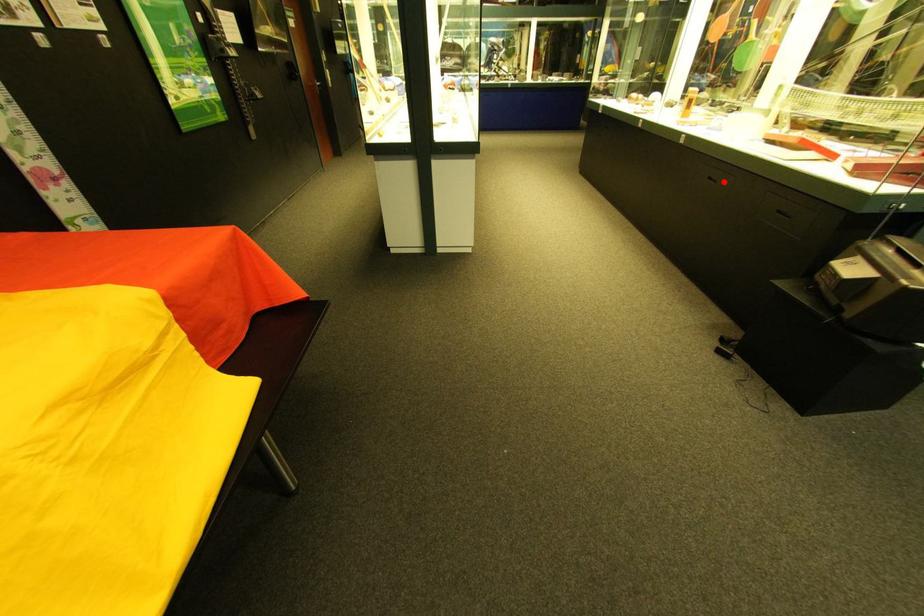
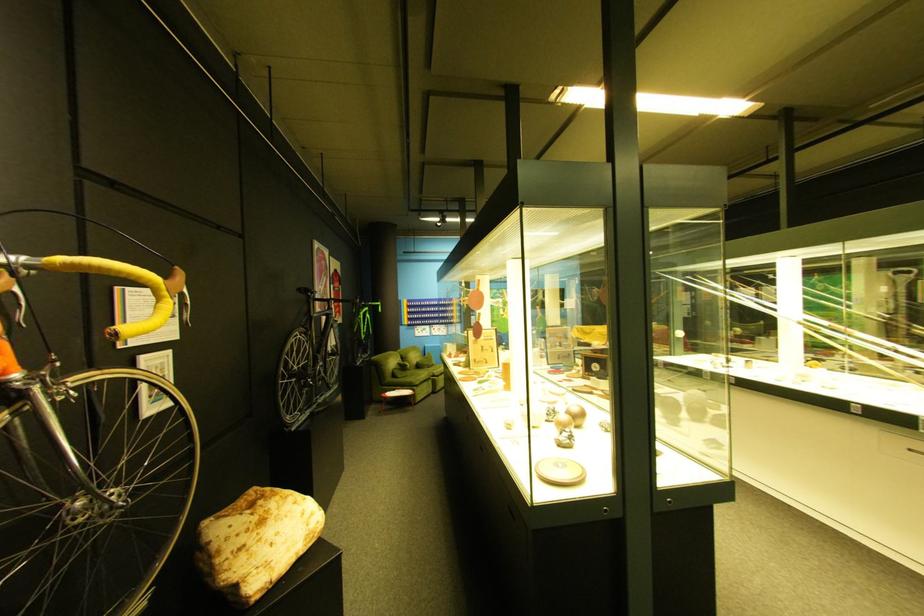
Question: I am providing you with two images of the same scene from different viewpoints. A red point is marked on the first image. Is the red point's position out of view in image 2?

Choices:
 (A) Yes
 (B) No

Answer: (A)